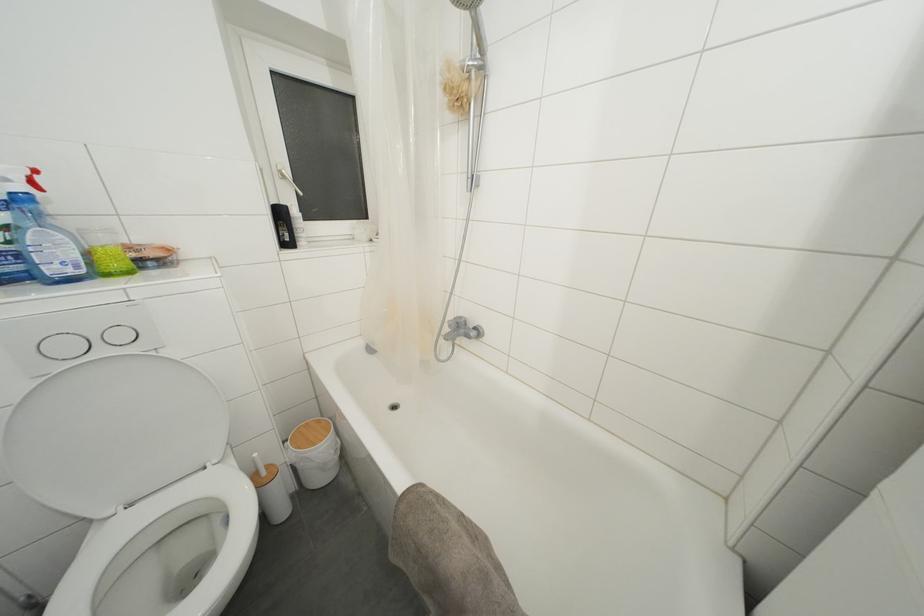
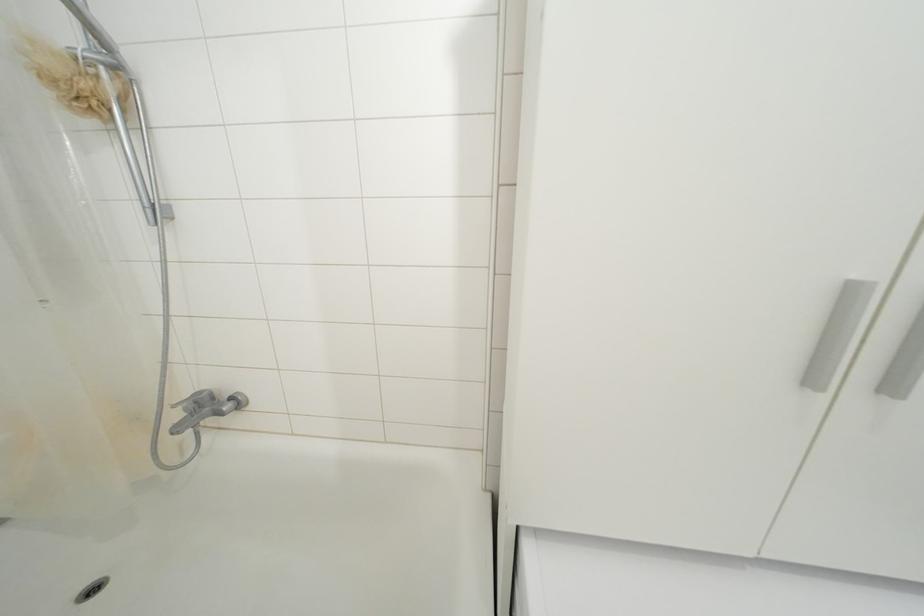
Question: Based on the continuous images, in which direction is the camera rotating? Reply with the corresponding letter.

Choices:
 (A) Left
 (B) Right
 (C) Up
 (D) Down

Answer: (B)